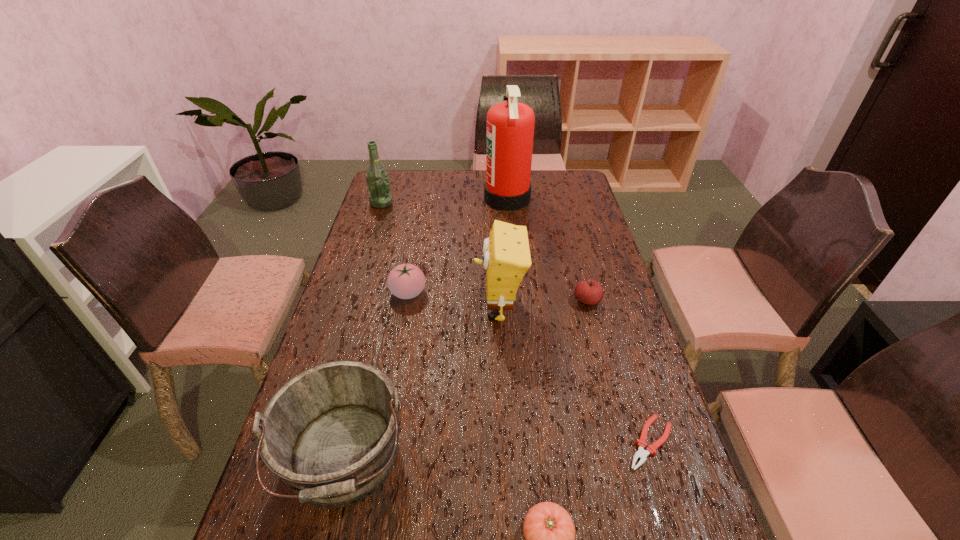
Image resolution: width=960 pixels, height=540 pixels. I want to click on vacant space located 0.310m at the nozzle of the tallest object, so click(410, 199).

Identify the location of vacant space located on the face of the sponge. This screenshot has width=960, height=540. (383, 308).

This screenshot has width=960, height=540. Identify the location of free space located 0.120m on the face of the sponge. (435, 308).

Identify the location of vacant space located on the face of the sponge. The height and width of the screenshot is (540, 960). (364, 308).

You are a GUI agent. You are given a task and a screenshot of the screen. Output one action in this format:
    pyautogui.click(x=<x>, y=<y>)
    Task: Click on the free point located 0.220m on the surface of the beer bottle
    This screenshot has height=540, width=960.
    Given the screenshot: What is the action you would take?
    pyautogui.click(x=446, y=203)

This screenshot has height=540, width=960. In order to click on free location located 0.380m on the back of the fourth tallest object in this screenshot , I will do `click(384, 296)`.

Identify the location of vacant space situated 0.100m on the right of the tallest tomato. (458, 293).

The height and width of the screenshot is (540, 960). Find the location of `vacant space located 0.190m on the back of the rightmost tomato`. vacant space located 0.190m on the back of the rightmost tomato is located at coordinates (575, 255).

Where is `vacant region located on the back of the pliers`? The width and height of the screenshot is (960, 540). vacant region located on the back of the pliers is located at coordinates (633, 385).

Identify the location of fire extinguisher located in the far edge section of the desktop. Image resolution: width=960 pixels, height=540 pixels. (510, 125).